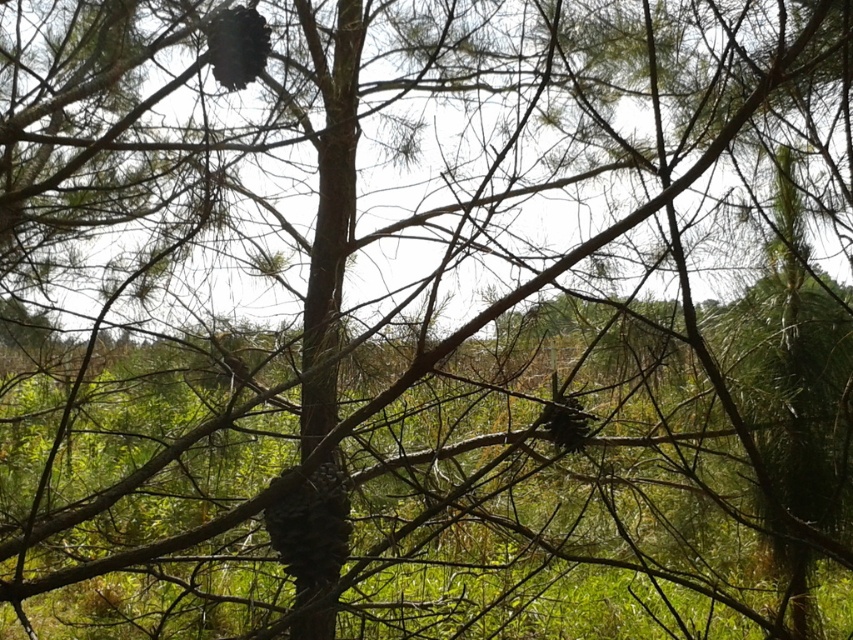
Question: Among these objects, which one is nearest to the camera?

Choices:
 (A) brown rough pine cone at center
 (B) dark brown textured pine cone at upper center

Answer: (B)

Question: Is brown rough pine cone at center below dark brown textured pine cone at upper center?

Choices:
 (A) yes
 (B) no

Answer: (A)

Question: Is brown rough pine cone at center above dark brown textured pine cone at upper center?

Choices:
 (A) no
 (B) yes

Answer: (A)

Question: Is brown rough pine cone at center to the right of dark brown textured pine cone at upper center from the viewer's perspective?

Choices:
 (A) no
 (B) yes

Answer: (B)